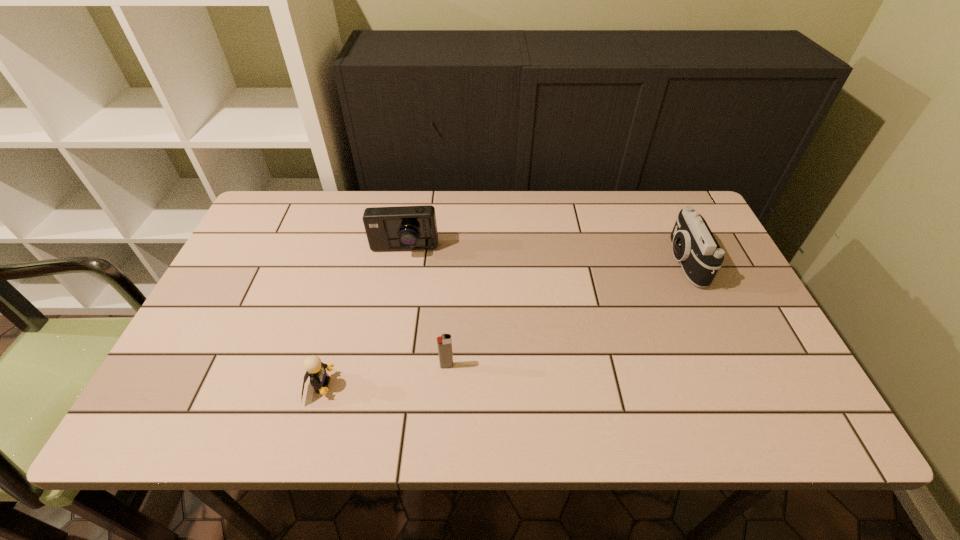
The image size is (960, 540). Find the location of `vacant space that is in between the Lego and the second object from right to left`. vacant space that is in between the Lego and the second object from right to left is located at coordinates (383, 376).

Identify the location of free space between the left camera and the igniter. click(425, 308).

Identify the location of free spot between the igniter and the rightmost object. Image resolution: width=960 pixels, height=540 pixels. (565, 314).

In order to click on free space between the second object from left to right and the igniter in this screenshot , I will do `click(425, 308)`.

The image size is (960, 540). In order to click on free space between the leftmost object and the third object from right to left in this screenshot , I will do `click(362, 318)`.

Find the location of a particular element. The height and width of the screenshot is (540, 960). empty location between the left camera and the igniter is located at coordinates (425, 308).

Identify the location of free space between the right camera and the igniter. (565, 314).

The image size is (960, 540). What are the coordinates of `object that is the closest to the Lego` in the screenshot? It's located at (444, 342).

Image resolution: width=960 pixels, height=540 pixels. I want to click on object that is the closest one to the igniter, so click(316, 370).

Identify the location of vacant space that satisfies the following two spatial constraints: 1. on the front-facing side of the second object from left to right; 2. on the front-facing side of the leftmost object. (380, 386).